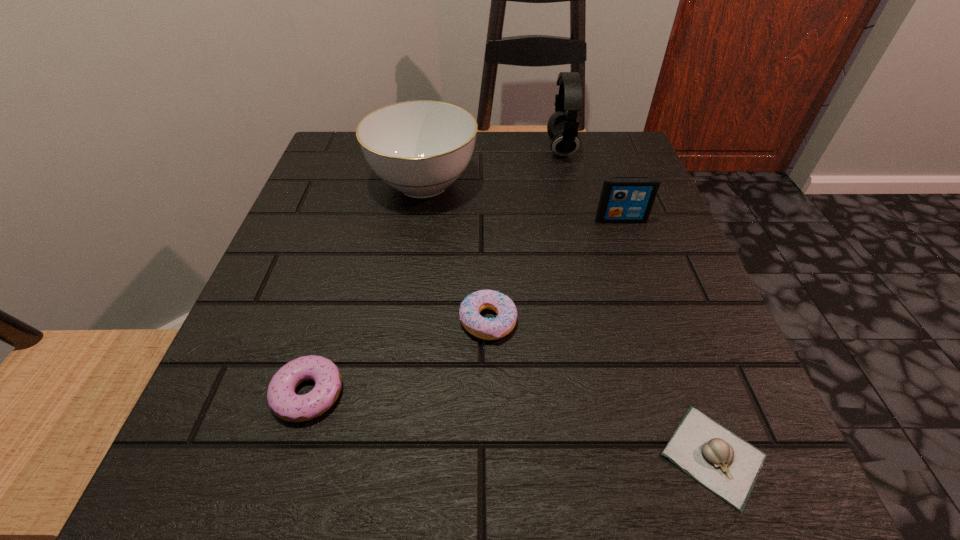
Where is `free space located on the ear cups of the earphone`? free space located on the ear cups of the earphone is located at coordinates (430, 148).

The width and height of the screenshot is (960, 540). I want to click on vacant region located on the right of the fifth shortest object, so click(x=531, y=184).

Find the location of a particular element. The width and height of the screenshot is (960, 540). free region located on the front screen of the fourth shortest object is located at coordinates (663, 341).

Find the location of a particular element. free space located 0.130m on the left of the farther doughnut is located at coordinates (374, 321).

Where is `free spot located 0.380m on the back of the nearer doughnut`? This screenshot has width=960, height=540. free spot located 0.380m on the back of the nearer doughnut is located at coordinates (366, 200).

At what (x,y) coordinates should I click in order to perform the action: click on vacant space located on the back of the garlic. Please return your answer as a coordinate pair (x, y). The width and height of the screenshot is (960, 540). Looking at the image, I should click on (670, 337).

Identify the location of earphone at the far edge. The height and width of the screenshot is (540, 960). (562, 127).

The height and width of the screenshot is (540, 960). Identify the location of chinaware that is at the far edge. (420, 148).

Find the location of `object at the near edge`. object at the near edge is located at coordinates [726, 464].

Find the location of a particular element. chinaware that is at the left edge is located at coordinates (420, 148).